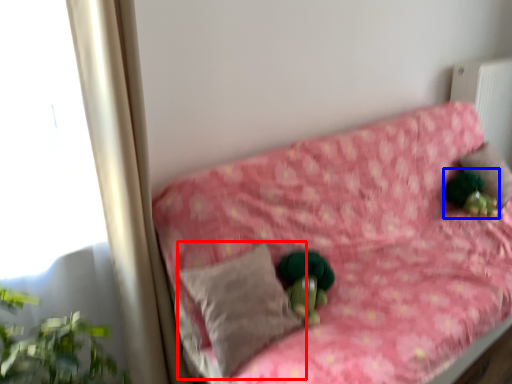
Question: Which point is further to the camera, pillow (highlighted by a red box) or figurine (highlighted by a blue box)?

Choices:
 (A) pillow
 (B) figurine

Answer: (B)